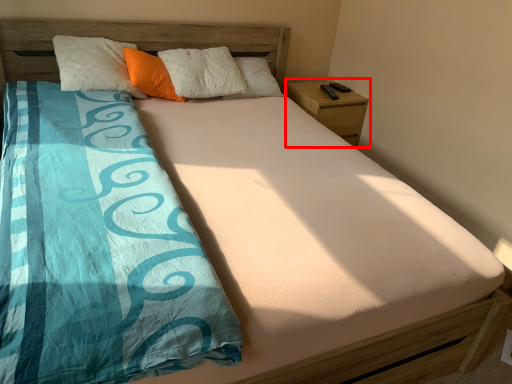
Question: From the image's perspective, where is nightstand (annotated by the red box) located relative to pillow?

Choices:
 (A) above
 (B) below

Answer: (B)